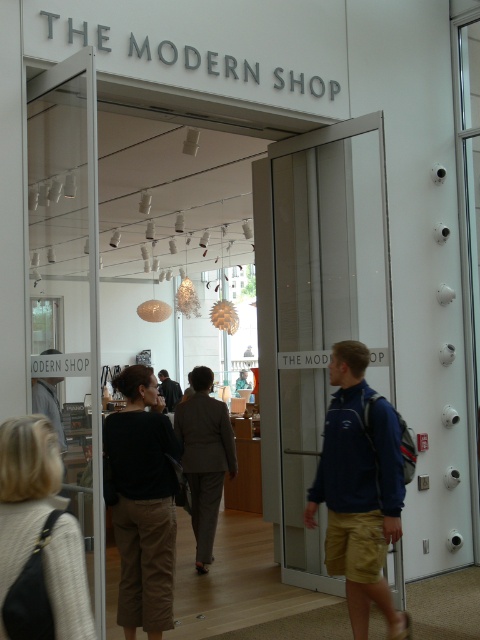
Who is more distant from viewer, [228,428] or [176,403]?

The point [176,403] is behind.

Between gray fabric suit at center and dark gray suit at center, which one has more height?

With more height is gray fabric suit at center.

The width and height of the screenshot is (480, 640). What are the coordinates of `gray fabric suit at center` in the screenshot? It's located at (204, 458).

Does transparent glass door at center have a greater width compared to light beige sweater at lower left?

Indeed, transparent glass door at center has a greater width compared to light beige sweater at lower left.

The width and height of the screenshot is (480, 640). What do you see at coordinates (321, 312) in the screenshot?
I see `transparent glass door at center` at bounding box center [321, 312].

Where is `transparent glass door at center`? The height and width of the screenshot is (640, 480). transparent glass door at center is located at coordinates (x=321, y=312).

Does blue fabric jacket at center come behind dark gray suit at center?

No, blue fabric jacket at center is closer to the viewer.

Image resolution: width=480 pixels, height=640 pixels. I want to click on blue fabric jacket at center, so click(x=360, y=490).